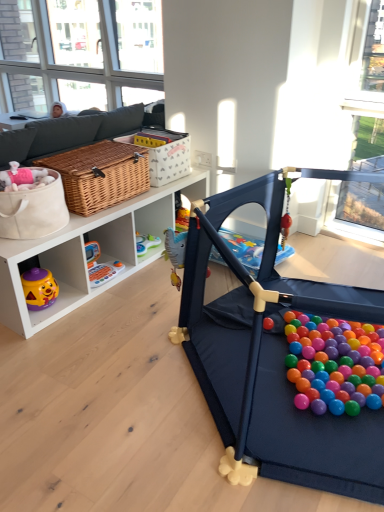
This screenshot has width=384, height=512. Identify the location of clear glass window at upper left. (62, 51).

Find the location of a particular element. The height and width of the screenshot is (512, 384). woven brown basket at upper center is located at coordinates (163, 153).

The image size is (384, 512). What do you see at coordinates (163, 153) in the screenshot?
I see `woven brown basket at upper center` at bounding box center [163, 153].

The width and height of the screenshot is (384, 512). Identify the location of rubberized plastic toy at lower left, marked as the 1th toy in a left-to-right arrangement. (100, 266).

From a real-world perspective, is woven brown picnic basket at center-left physically below woven brown basket at upper center?

Yes, from a real-world perspective, woven brown picnic basket at center-left is under woven brown basket at upper center.

Does woven brown picnic basket at center-left contain woven brown basket at upper center?

That's incorrect, woven brown basket at upper center is not inside woven brown picnic basket at center-left.

Which of these two, woven brown picnic basket at center-left or woven brown basket at upper center, stands shorter?

woven brown picnic basket at center-left is shorter.

Which object is wider, woven brown picnic basket at center-left or woven brown basket at upper center?

With larger width is woven brown picnic basket at center-left.

Considering the positions of points (318, 468) and (83, 7), is point (318, 468) farther from camera compared to point (83, 7)?

No, (318, 468) is in front of (83, 7).

From a real-world perspective, which is physically above, matte wicker basket at center-left, which is the 1th toy from right to left, or clear glass window at upper left?

In real-world perspective, clear glass window at upper left is above.

Is clear glass window at upper left at the back of matte wicker basket at center-left, which is the 1th toy from right to left?

No.

Can you confirm if matte wicker basket at center-left, which is the 1th toy from right to left, is bigger than clear glass window at upper left?

Yes, matte wicker basket at center-left, which is the 1th toy from right to left, is bigger than clear glass window at upper left.

From the picture: Which of these two, rubberized plastic toy at lower left, the second toy from the right, or matte wicker basket at center-left, the second toy from the left, stands shorter?

rubberized plastic toy at lower left, the second toy from the right.

Is point (114, 261) behind point (269, 339)?

Yes.

Is rubberized plastic toy at lower left, the second toy from the right, to the left of matte wicker basket at center-left, which is the 1th toy from right to left, from the viewer's perspective?

Yes.

Could you measure the distance between rubberized plastic toy at lower left, marked as the 1th toy in a left-to-right arrangement, and matte wicker basket at center-left, which is the 1th toy from front to back?

The distance of rubberized plastic toy at lower left, marked as the 1th toy in a left-to-right arrangement, from matte wicker basket at center-left, which is the 1th toy from front to back, is 38.19 inches.

Can you confirm if matte wicker basket at center-left, arranged as the 1th toy when viewed from the top, is bigger than rubberized plastic toy at lower left, the first toy from the bottom?

Yes, matte wicker basket at center-left, arranged as the 1th toy when viewed from the top, is bigger than rubberized plastic toy at lower left, the first toy from the bottom.

Between point (235, 191) and point (97, 286), which one is positioned in front?

Point (235, 191)

Is the position of matte wicker basket at center-left, arranged as the 1th toy when viewed from the top, less distant than that of rubberized plastic toy at lower left, marked as the 1th toy in a left-to-right arrangement?

Yes, it is.

Considering the positions of objects woven brown picnic basket at center-left and rubberized plastic toy at lower left, placed as the second toy when sorted from front to back, in the image provided, who is more to the left, woven brown picnic basket at center-left or rubberized plastic toy at lower left, placed as the second toy when sorted from front to back,?

woven brown picnic basket at center-left is more to the left.

Consider the image. Is woven brown picnic basket at center-left in front of or behind rubberized plastic toy at lower left, the first toy from the bottom, in the image?

Clearly, woven brown picnic basket at center-left is in front of rubberized plastic toy at lower left, the first toy from the bottom.

Between point (95, 159) and point (98, 282), which one is positioned behind?

The point (98, 282) is more distant.

Who is smaller, clear glass window at upper left or rubberized plastic toy at lower left, the second toy from the right?

rubberized plastic toy at lower left, the second toy from the right.

Consider the image. Would you say clear glass window at upper left is to the left or to the right of rubberized plastic toy at lower left, placed as the second toy when sorted from front to back, in the picture?

From the image, it's evident that clear glass window at upper left is to the left of rubberized plastic toy at lower left, placed as the second toy when sorted from front to back.

Relative to rubberized plastic toy at lower left, the second toy from the right, is clear glass window at upper left in front or behind?

In the image, clear glass window at upper left appears behind rubberized plastic toy at lower left, the second toy from the right.

You are a GUI agent. You are given a task and a screenshot of the screen. Output one action in this format:
    pyautogui.click(x=<x>, y=<y>)
    Task: Click on the window screen that is above the rubberized plastic toy at lower left, the 2th toy from the top (from the image's perspective)
    This screenshot has width=384, height=512.
    Given the screenshot: What is the action you would take?
    pyautogui.click(x=62, y=51)

What's the angular difference between woven brown basket at upper center and woven brown picnic basket at center-left's facing directions?

0.0053 degrees.

Is woven brown basket at upper center oriented towards woven brown picnic basket at center-left?

No, woven brown basket at upper center is not aimed at woven brown picnic basket at center-left.

Locate an element on the screen. The width and height of the screenshot is (384, 512). basket that appears on the right of woven brown picnic basket at center-left is located at coordinates (163, 153).

From a real-world perspective, is woven brown basket at upper center physically above woven brown picnic basket at center-left?

Yes, from a real-world perspective, woven brown basket at upper center is over woven brown picnic basket at center-left

Find the location of a particular element. basket above the woven brown picnic basket at center-left (from a real-world perspective) is located at coordinates (163, 153).

Which toy is the 2nd one when counting from the right side of the clear glass window at upper left? Please provide its 2D coordinates.

[(271, 360)]

When comparing their distances from matte wicker basket at center-left, which is the 1th toy from front to back, does rubberized plastic toy at lower left, the second toy from the right, or woven brown picnic basket at center-left seem closer?

woven brown picnic basket at center-left is closer to matte wicker basket at center-left, which is the 1th toy from front to back.

Considering their positions, is rubberized plastic toy at lower left, the first toy from the bottom, positioned closer to woven brown picnic basket at center-left than woven brown basket at upper center?

woven brown basket at upper center is closer to woven brown picnic basket at center-left.

Estimate the real-world distances between objects in this image. Which object is closer to matte wicker basket at center-left, which is the 1th toy from front to back, woven brown picnic basket at center-left or clear glass window at upper left?

woven brown picnic basket at center-left is positioned closer to the anchor matte wicker basket at center-left, which is the 1th toy from front to back.

Based on their spatial positions, is matte wicker basket at center-left, the second toy from the left, or woven brown basket at upper center closer to woven brown picnic basket at center-left?

Among the two, woven brown basket at upper center is located nearer to woven brown picnic basket at center-left.

From the image, which object appears to be farther from matte wicker basket at center-left, which is the 1th toy from right to left, woven brown basket at upper center or woven brown picnic basket at center-left?

woven brown basket at upper center is further to matte wicker basket at center-left, which is the 1th toy from right to left.

When comparing their distances from woven brown basket at upper center, does matte wicker basket at center-left, placed as the 2th toy when sorted from bottom to top, or clear glass window at upper left seem closer?

matte wicker basket at center-left, placed as the 2th toy when sorted from bottom to top, is positioned closer to the anchor woven brown basket at upper center.

Based on their spatial positions, is clear glass window at upper left or woven brown basket at upper center closer to matte wicker basket at center-left, the second toy from the left?

The object closer to matte wicker basket at center-left, the second toy from the left, is woven brown basket at upper center.

Considering their positions, is woven brown basket at upper center positioned further to rubberized plastic toy at lower left, the first toy from the bottom, than matte wicker basket at center-left, placed as the 2th toy when sorted from bottom to top?

matte wicker basket at center-left, placed as the 2th toy when sorted from bottom to top, is positioned further to the anchor rubberized plastic toy at lower left, the first toy from the bottom.

Where is `picnic basket between matte wicker basket at center-left, arranged as the 1th toy when viewed from the top, and woven brown basket at upper center from front to back`? This screenshot has width=384, height=512. picnic basket between matte wicker basket at center-left, arranged as the 1th toy when viewed from the top, and woven brown basket at upper center from front to back is located at coordinates (100, 175).

Locate an element on the screen. Image resolution: width=384 pixels, height=512 pixels. picnic basket between clear glass window at upper left and rubberized plastic toy at lower left, marked as the 1th toy in a left-to-right arrangement, from top to bottom is located at coordinates (100, 175).

Locate an element on the screen. basket between matte wicker basket at center-left, which ranks as the 2th toy in back-to-front order, and clear glass window at upper left from front to back is located at coordinates (163, 153).

You are a GUI agent. You are given a task and a screenshot of the screen. Output one action in this format:
    pyautogui.click(x=<x>, y=<y>)
    Task: Click on the basket between clear glass window at upper left and woven brown picnic basket at center-left in the up-down direction
    This screenshot has width=384, height=512.
    Given the screenshot: What is the action you would take?
    pyautogui.click(x=163, y=153)